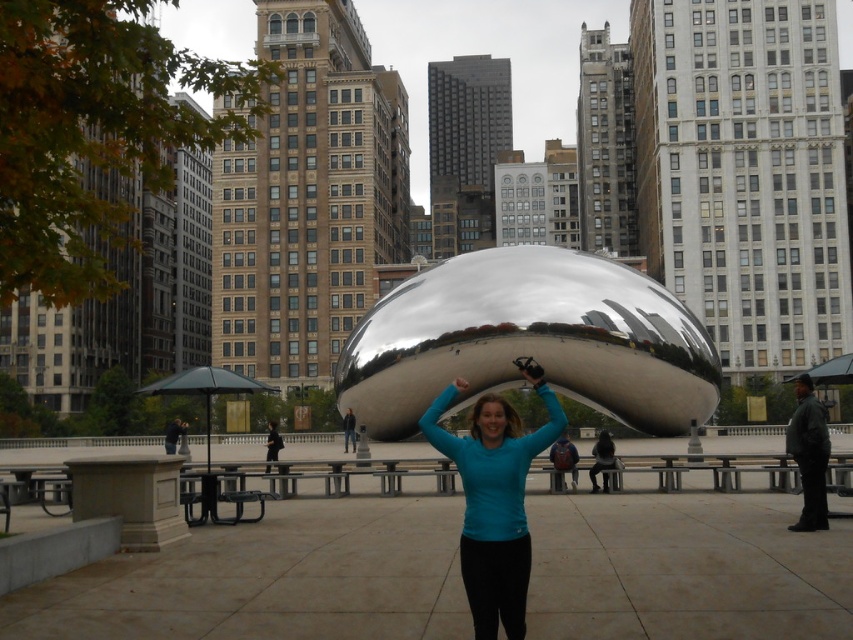
You are a photographer trying to capture the woman in the scene. The woman is wearing a teal fabric shirt at center and has dark brown hair at center. Which of these two items is bigger in size?

The teal fabric shirt at center is larger in size than the dark brown hair at center.

You are a photographer trying to capture a photo of the polished metallic sculpture at center and the teal fabric shirt at center. Based on their sizes, which object should you focus on first to ensure both are in frame?

The polished metallic sculpture at center is wider than the teal fabric shirt at center, so you should focus on the polished metallic sculpture at center first to ensure both fit in the frame.

You are a photographer trying to capture a photo of the woman in the scene. The woman is wearing a teal fabric shirt at center and has dark brown hair at center. Which part of her is higher in the frame?

The teal fabric shirt at center is much taller than dark brown hair at center, so the shirt is higher in the frame.